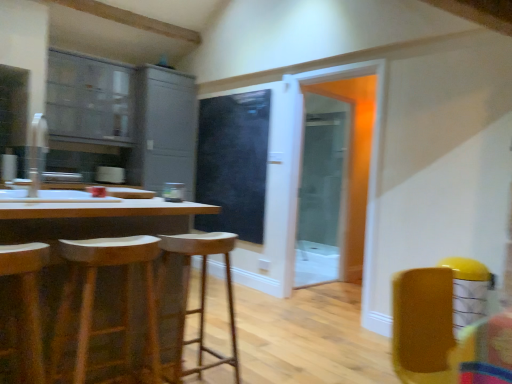
Question: Is wooden table at left to the right of black matte screen door at center, marked as the 1th screen door in a left-to-right arrangement, from the viewer's perspective?

Choices:
 (A) yes
 (B) no

Answer: (B)

Question: Does wooden table at left have a lesser width compared to black matte screen door at center, marked as the 1th screen door in a left-to-right arrangement?

Choices:
 (A) no
 (B) yes

Answer: (A)

Question: Can you confirm if wooden table at left is smaller than black matte screen door at center, marked as the 1th screen door in a left-to-right arrangement?

Choices:
 (A) no
 (B) yes

Answer: (A)

Question: Is wooden table at left at the left side of black matte screen door at center, which appears as the 2th screen door when viewed from the right?

Choices:
 (A) no
 (B) yes

Answer: (B)

Question: From the image's perspective, is wooden table at left on black matte screen door at center, marked as the 1th screen door in a left-to-right arrangement?

Choices:
 (A) yes
 (B) no

Answer: (B)

Question: Considering the positions of wooden stool at center, which appears as the third stool when viewed from the front, and clear glass screen door at center, placed as the first screen door when sorted from right to left, in the image, is wooden stool at center, which appears as the third stool when viewed from the front, wider or thinner than clear glass screen door at center, placed as the first screen door when sorted from right to left,?

Choices:
 (A) thin
 (B) wide

Answer: (B)

Question: Is wooden stool at center, arranged as the 1th stool when viewed from the back, bigger or smaller than clear glass screen door at center, placed as the first screen door when sorted from right to left?

Choices:
 (A) small
 (B) big

Answer: (A)

Question: From the image's perspective, is wooden stool at center, which appears as the third stool when viewed from the front, located above or below clear glass screen door at center, the second screen door in the left-to-right sequence?

Choices:
 (A) above
 (B) below

Answer: (B)

Question: Is point (200, 370) positioned closer to the camera than point (331, 226)?

Choices:
 (A) farther
 (B) closer

Answer: (B)

Question: From their relative heights in the image, would you say black matte screen door at center, which appears as the 2th screen door when viewed from the right, is taller or shorter than wooden stool at center, arranged as the 1th stool when viewed from the back?

Choices:
 (A) tall
 (B) short

Answer: (A)

Question: Considering their positions, is black matte screen door at center, marked as the 1th screen door in a left-to-right arrangement, located in front of or behind wooden stool at center, arranged as the 1th stool when viewed from the back?

Choices:
 (A) front
 (B) behind

Answer: (B)

Question: From the image's perspective, is black matte screen door at center, which appears as the 2th screen door when viewed from the right, located above or below wooden stool at center, which appears as the third stool when viewed from the front?

Choices:
 (A) above
 (B) below

Answer: (A)

Question: From a real-world perspective, is black matte screen door at center, marked as the 1th screen door in a left-to-right arrangement, above or below wooden stool at center, which appears as the third stool when viewed from the front?

Choices:
 (A) below
 (B) above

Answer: (B)

Question: From a real-world perspective, is clear glass screen door at center, placed as the first screen door when sorted from right to left, physically located above or below white glossy sink at left?

Choices:
 (A) above
 (B) below

Answer: (B)

Question: Is clear glass screen door at center, placed as the first screen door when sorted from right to left, situated inside white glossy sink at left or outside?

Choices:
 (A) outside
 (B) inside

Answer: (A)